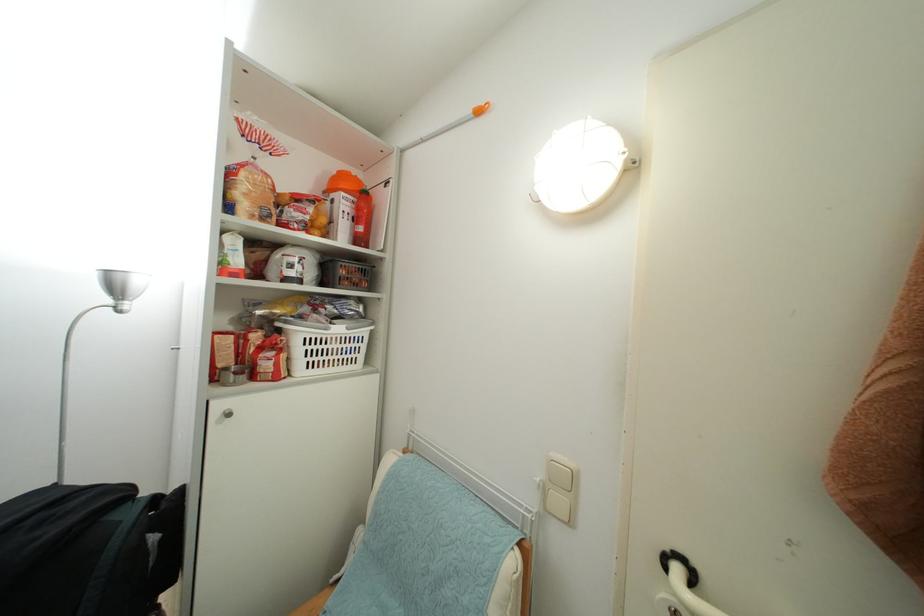
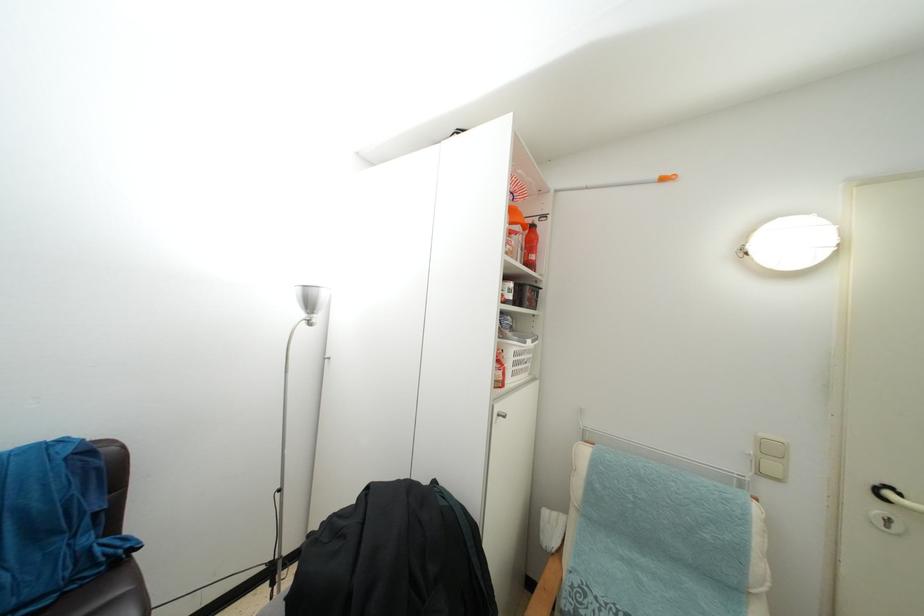
Find the pixel in the second image that matches point (682, 575) in the first image.

(893, 500)